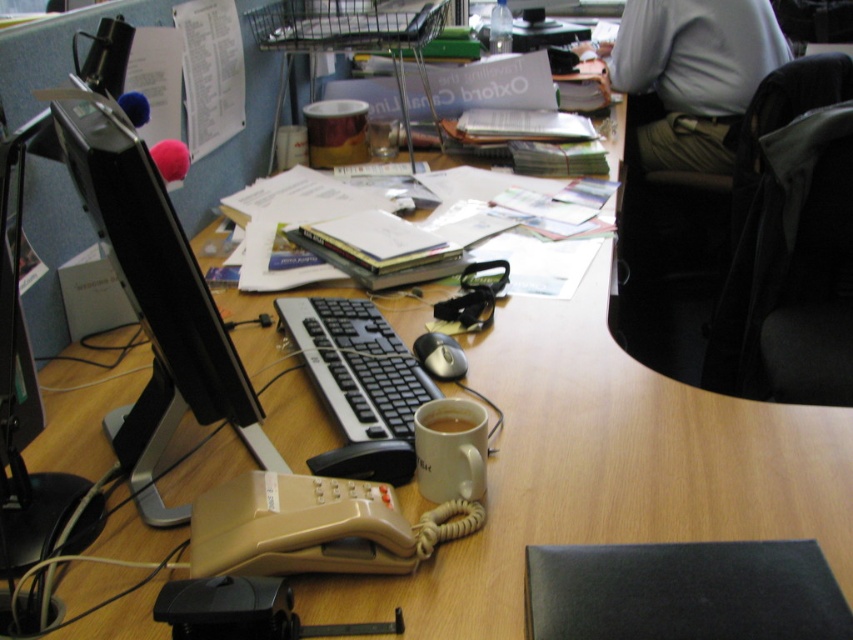
Question: Which object is the farthest from the white matte mug at center?

Choices:
 (A) black glossy monitor at left
 (B) black plastic mouse at center

Answer: (A)

Question: Which point is closer to the camera taking this photo?

Choices:
 (A) (668, 109)
 (B) (426, 426)

Answer: (B)

Question: Can you confirm if gray fabric shirt at upper right is positioned below matte ceramic mug at center?

Choices:
 (A) yes
 (B) no

Answer: (B)

Question: Is black glossy monitor at left closer to camera compared to matte ceramic mug at center?

Choices:
 (A) yes
 (B) no

Answer: (A)

Question: Which object is the closest to the gray fabric shirt at upper right?

Choices:
 (A) black plastic mouse at center
 (B) matte ceramic mug at center
 (C) black glossy monitor at left

Answer: (A)

Question: Can you confirm if black glossy monitor at left is positioned above black plastic mouse at center?

Choices:
 (A) yes
 (B) no

Answer: (A)